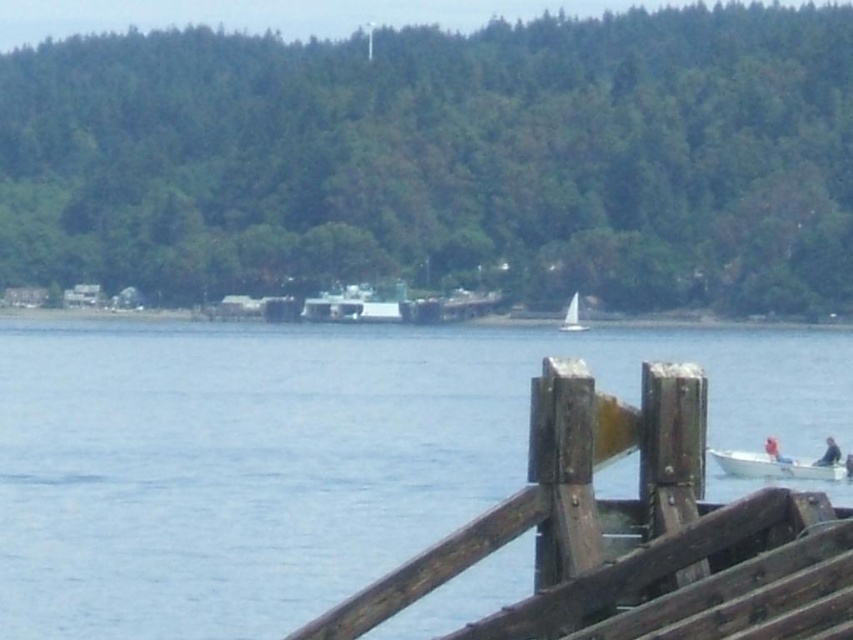
Can you confirm if brown wooden dock at lower right is positioned to the left of white sailboat at center?

Indeed, brown wooden dock at lower right is positioned on the left side of white sailboat at center.

Who is more distant from viewer, (474, 632) or (569, 326)?

Positioned behind is point (569, 326).

You are a GUI agent. You are given a task and a screenshot of the screen. Output one action in this format:
    pyautogui.click(x=<x>, y=<y>)
    Task: Click on the brown wooden dock at lower right
    The image size is (853, 640).
    Given the screenshot: What is the action you would take?
    pyautogui.click(x=634, y=534)

Where is `brown wooden dock at lower right`? brown wooden dock at lower right is located at coordinates (634, 534).

Is point (589, 416) closer to viewer compared to point (836, 458)?

Yes, point (589, 416) is in front of point (836, 458).

The height and width of the screenshot is (640, 853). I want to click on brown wooden dock at lower right, so click(634, 534).

Which is more to the left, white plastic boat at lower right or white sailboat at center?

From the viewer's perspective, white sailboat at center appears more on the left side.

Based on the photo, which of these two, white plastic boat at lower right or white sailboat at center, stands shorter?

With less height is white sailboat at center.

Where is `white plastic boat at lower right`? The image size is (853, 640). white plastic boat at lower right is located at coordinates (780, 464).

The image size is (853, 640). I want to click on white plastic boat at lower right, so click(x=780, y=464).